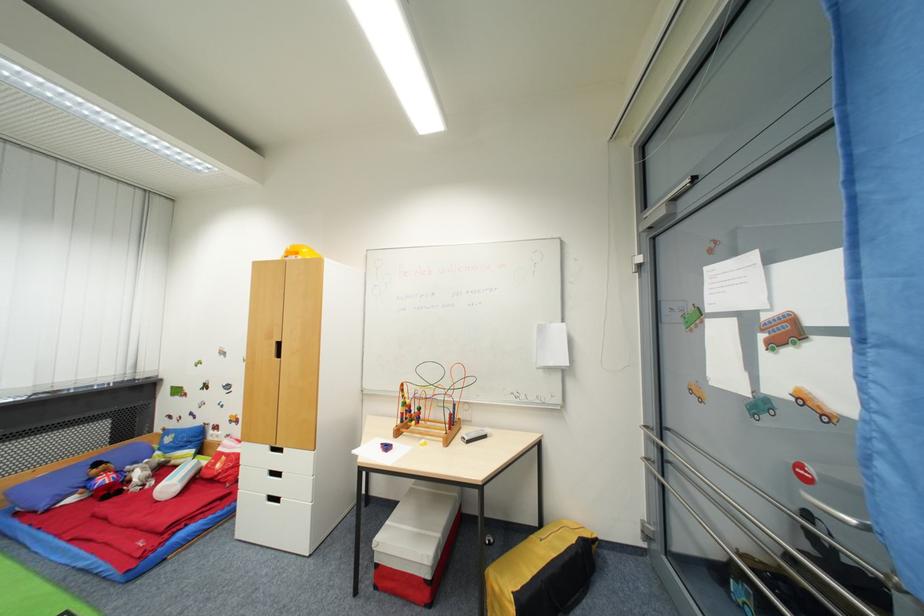
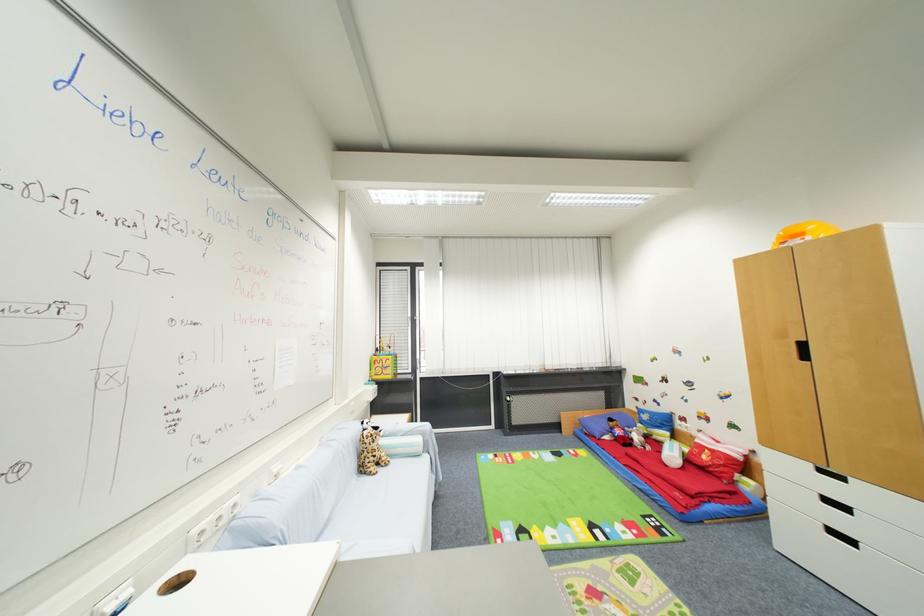
In the second image, find the point that corresponds to point (287, 254) in the first image.

(779, 243)